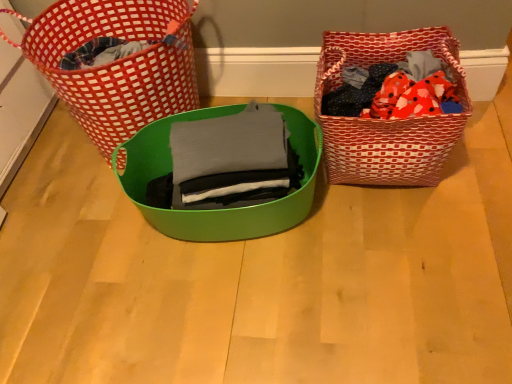
Question: Can you confirm if red woven picnic basket at left, the 2th picnic basket positioned from the right, is smaller than gray matte fabric at center?

Choices:
 (A) yes
 (B) no

Answer: (B)

Question: Considering the relative sizes of red woven picnic basket at left, the first picnic basket positioned from the left, and gray matte fabric at center in the image provided, is red woven picnic basket at left, the first picnic basket positioned from the left, bigger than gray matte fabric at center?

Choices:
 (A) no
 (B) yes

Answer: (B)

Question: From a real-world perspective, is red woven picnic basket at left, the 2th picnic basket positioned from the right, located beneath gray matte fabric at center?

Choices:
 (A) yes
 (B) no

Answer: (A)

Question: Could you tell me if red woven picnic basket at left, the 2th picnic basket positioned from the right, is turned towards gray matte fabric at center?

Choices:
 (A) yes
 (B) no

Answer: (B)

Question: From the image's perspective, is red woven picnic basket at left, the first picnic basket positioned from the left, over gray matte fabric at center?

Choices:
 (A) no
 (B) yes

Answer: (B)

Question: Based on their positions, is red woven picnic basket at left, the 2th picnic basket positioned from the right, located to the left or right of gray matte fabric at center?

Choices:
 (A) left
 (B) right

Answer: (A)

Question: Considering the positions of red woven picnic basket at left, the 2th picnic basket positioned from the right, and gray matte fabric at center in the image, is red woven picnic basket at left, the 2th picnic basket positioned from the right, taller or shorter than gray matte fabric at center?

Choices:
 (A) tall
 (B) short

Answer: (A)

Question: Is red woven picnic basket at left, the first picnic basket positioned from the left, inside the boundaries of gray matte fabric at center, or outside?

Choices:
 (A) inside
 (B) outside

Answer: (B)

Question: Is red woven picnic basket at left, the first picnic basket positioned from the left, wider or thinner than gray matte fabric at center?

Choices:
 (A) wide
 (B) thin

Answer: (A)

Question: Is green plastic bowl at center taller or shorter than red woven picnic basket at left, the 2th picnic basket positioned from the right?

Choices:
 (A) short
 (B) tall

Answer: (A)

Question: Choose the correct answer: Is green plastic bowl at center inside red woven picnic basket at left, the first picnic basket positioned from the left, or outside it?

Choices:
 (A) inside
 (B) outside

Answer: (B)

Question: From a real-world perspective, is green plastic bowl at center above or below red woven picnic basket at left, the 2th picnic basket positioned from the right?

Choices:
 (A) below
 (B) above

Answer: (A)

Question: Is green plastic bowl at center to the left or to the right of red woven picnic basket at left, the first picnic basket positioned from the left, in the image?

Choices:
 (A) left
 (B) right

Answer: (B)

Question: Do you think red woven picnic basket at left, the first picnic basket positioned from the left, is within red woven picnic basket at right, which is counted as the first picnic basket, starting from the right, or outside of it?

Choices:
 (A) outside
 (B) inside

Answer: (A)

Question: Is point (102, 1) closer or farther from the camera than point (454, 142)?

Choices:
 (A) farther
 (B) closer

Answer: (A)